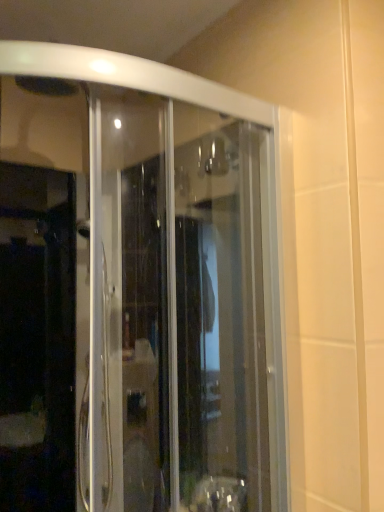
Where is `transparent glass shower door at center`? The width and height of the screenshot is (384, 512). transparent glass shower door at center is located at coordinates (187, 313).

Measure the distance between transparent glass shower door at center and camera.

A distance of 25.48 inches exists between transparent glass shower door at center and camera.

This screenshot has height=512, width=384. What do you see at coordinates (187, 313) in the screenshot?
I see `transparent glass shower door at center` at bounding box center [187, 313].

Locate an element on the screen. transparent glass shower door at center is located at coordinates (187, 313).